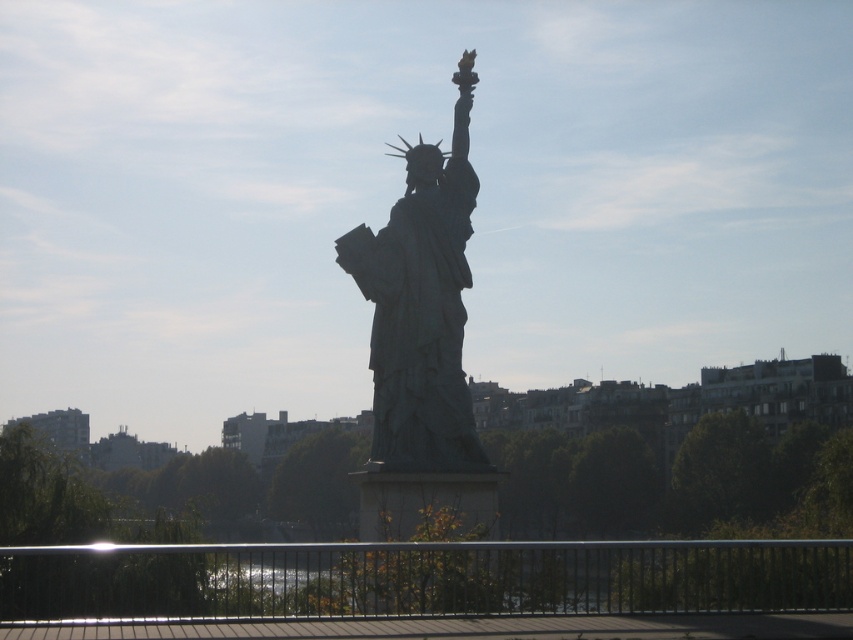
Is black metal railing at lower center above green patina statue at center?

Incorrect, black metal railing at lower center is not positioned above green patina statue at center.

Who is more distant from viewer, (291, 605) or (444, 440)?

Positioned behind is point (444, 440).

Is point (90, 611) closer to viewer compared to point (416, 362)?

Yes, point (90, 611) is closer to viewer.

Locate an element on the screen. The image size is (853, 640). black metal railing at lower center is located at coordinates (418, 579).